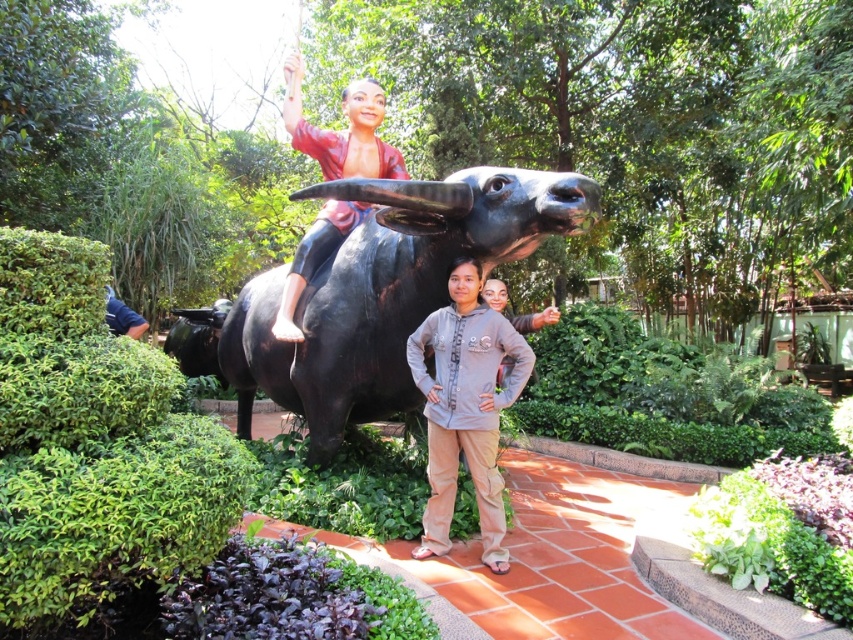
You are a photographer trying to capture a clear shot of the shiny black bull at center and the gray cotton hoodie at center. Based on their positions, which object is closer to the camera?

The shiny black bull at center is located above the gray cotton hoodie at center, so the gray cotton hoodie at center is closer to the camera since it is positioned lower in the frame.

You are standing in front of the statue and want to take a photo of the gray cotton hoodie at center and the shiny black bull at center. Which object should you frame first in your camera viewfinder to ensure both are captured?

You should frame the shiny black bull at center first since it is to the left of the gray cotton hoodie at center, ensuring both are included in the photo.

Consider the image. You are standing in front of the statue scene described. You want to take a photo of the shiny black bull at center without any people in the frame. The two individuals in front are 5 feet away from you. Can you step back enough to exclude them from the photo while still capturing the bull clearly?

The distance between you and the shiny black bull at center is 12.04 feet. Since the people are only 5 feet away from you, stepping back approximately 7 feet would position you 12.04 feet away from the bull, which is the required distance to capture it clearly. This would also move you far enough to avoid the people in the foreground.